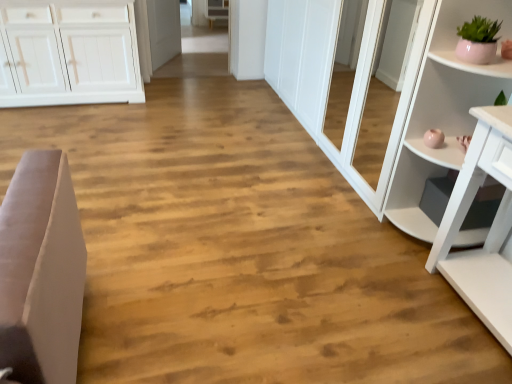
Measure the distance between white glossy shelf at right and camera.

white glossy shelf at right is 1.77 meters from camera.

The height and width of the screenshot is (384, 512). In order to click on white glossy door at center in this screenshot , I will do [163, 30].

Identify the location of white wood cabinet at upper center. This screenshot has height=384, width=512. (216, 10).

The image size is (512, 384). What do you see at coordinates (478, 40) in the screenshot?
I see `matte pink pot at upper right` at bounding box center [478, 40].

At what (x,y) coordinates should I click in order to perform the action: click on white glossy shelf at right. Please return your answer as a coordinate pair (x, y). Image resolution: width=512 pixels, height=384 pixels. Looking at the image, I should click on (441, 112).

Which is closer to the camera, (488,26) or (220,11)?

Point (488,26)

Locate an element on the screen. This screenshot has width=512, height=384. cabinetry directly beneath the matte pink pot at upper right (from a real-world perspective) is located at coordinates (216, 10).

From a real-world perspective, which object rests below the other?

From a 3D spatial view, white wood cabinet at upper center is below.

From the image's perspective, between matte pink pot at upper right and white wood cabinet at upper center, which one is located above?

white wood cabinet at upper center is shown above in the image.

How many degrees apart are the facing directions of white glossy door at center and white glossy shelf at right?

white glossy door at center and white glossy shelf at right are facing 151 degrees away from each other.

From the image's perspective, is white glossy door at center over white glossy shelf at right?

Yes, from the image's perspective, white glossy door at center is over white glossy shelf at right.

Who is bigger, white glossy door at center or white glossy shelf at right?

With larger size is white glossy shelf at right.

I want to click on door behind the white glossy shelf at right, so click(163, 30).

Considering the positions of objects white glossy door at center and matte pink pot at upper right in the image provided, who is more to the left, white glossy door at center or matte pink pot at upper right?

From the viewer's perspective, white glossy door at center appears more on the left side.

Is white glossy door at center positioned before matte pink pot at upper right?

No.

Locate an element on the screen. houseplant in front of the white glossy door at center is located at coordinates (478, 40).

In the scene shown: Considering the relative sizes of white glossy door at center and matte pink pot at upper right in the image provided, is white glossy door at center shorter than matte pink pot at upper right?

Incorrect, the height of white glossy door at center does not fall short of that of matte pink pot at upper right.

Does white glossy shelf at right appear on the right side of matte pink pot at upper right?

Yes, white glossy shelf at right is to the right of matte pink pot at upper right.

Are white glossy shelf at right and matte pink pot at upper right far apart?

No, there isn't a large distance between white glossy shelf at right and matte pink pot at upper right.

Does white glossy shelf at right have a smaller size compared to matte pink pot at upper right?

No, white glossy shelf at right is not smaller than matte pink pot at upper right.

How distant is white glossy shelf at right from matte pink pot at upper right?

white glossy shelf at right and matte pink pot at upper right are 15.01 inches apart from each other.

Locate an element on the screen. cabinetry to the left of white glossy shelf at right is located at coordinates (216, 10).

How different are the orientations of white wood cabinet at upper center and white glossy shelf at right in degrees?

The angle between the facing direction of white wood cabinet at upper center and the facing direction of white glossy shelf at right is 88.3 degrees.

Is white wood cabinet at upper center shorter than white glossy shelf at right?

Indeed, white wood cabinet at upper center has a lesser height compared to white glossy shelf at right.

Between white wood cabinet at upper center and white glossy shelf at right, which one has smaller width?

white wood cabinet at upper center is thinner.

From a real-world perspective, does white wood cabinet at upper center sit lower than white glossy door at center?

Indeed, from a real-world perspective, white wood cabinet at upper center is positioned beneath white glossy door at center.

Is there a large distance between white wood cabinet at upper center and white glossy door at center?

white wood cabinet at upper center is far away from white glossy door at center.

Between white wood cabinet at upper center and white glossy door at center, which one appears on the left side from the viewer's perspective?

Positioned to the left is white glossy door at center.

Which is closer to the camera, (205, 6) or (164, 34)?

Point (205, 6).

From the picture: From the image's perspective, would you say matte pink pot at upper right is shown under white glossy door at center?

Yes.

Is matte pink pot at upper right taller or shorter than white glossy door at center?

Clearly, matte pink pot at upper right is shorter compared to white glossy door at center.

Considering the relative positions of matte pink pot at upper right and white glossy door at center in the image provided, is matte pink pot at upper right to the left or to the right of white glossy door at center?

Based on their positions, matte pink pot at upper right is located to the right of white glossy door at center.

Considering the relative sizes of matte pink pot at upper right and white glossy door at center in the image provided, is matte pink pot at upper right wider than white glossy door at center?

Yes, matte pink pot at upper right is wider than white glossy door at center.

The image size is (512, 384). I want to click on cabinetry above the matte pink pot at upper right (from the image's perspective), so click(x=216, y=10).

Locate an element on the screen. The image size is (512, 384). shelf in front of the white glossy door at center is located at coordinates (441, 112).

From the image, which object appears to be nearer to white glossy shelf at right, white wood cabinet at upper center or matte pink pot at upper right?

matte pink pot at upper right is closer to white glossy shelf at right.

Estimate the real-world distances between objects in this image. Which object is closer to matte pink pot at upper right, white glossy shelf at right or white glossy door at center?

white glossy shelf at right is closer to matte pink pot at upper right.

Considering their positions, is white glossy door at center positioned closer to white wood cabinet at upper center than matte pink pot at upper right?

Among the two, white glossy door at center is located nearer to white wood cabinet at upper center.

Estimate the real-world distances between objects in this image. Which object is further from white glossy door at center, white wood cabinet at upper center or white glossy shelf at right?

white glossy shelf at right is positioned further to the anchor white glossy door at center.

Based on their spatial positions, is white glossy door at center or matte pink pot at upper right closer to white glossy shelf at right?

Among the two, matte pink pot at upper right is located nearer to white glossy shelf at right.

Considering their positions, is matte pink pot at upper right positioned further to white wood cabinet at upper center than white glossy door at center?

Based on the image, matte pink pot at upper right appears to be further to white wood cabinet at upper center.

Estimate the real-world distances between objects in this image. Which object is closer to white wood cabinet at upper center, white glossy door at center or white glossy shelf at right?

white glossy door at center is positioned closer to the anchor white wood cabinet at upper center.

Looking at the image, which one is located closer to white wood cabinet at upper center, matte pink pot at upper right or white glossy shelf at right?

The object closer to white wood cabinet at upper center is white glossy shelf at right.

Find the location of a particular element. door between white glossy shelf at right and white wood cabinet at upper center in the front-back direction is located at coordinates (163, 30).

You are a GUI agent. You are given a task and a screenshot of the screen. Output one action in this format:
    pyautogui.click(x=<x>, y=<y>)
    Task: Click on the houseplant between white glossy shelf at right and white wood cabinet at upper center in the front-back direction
    The height and width of the screenshot is (384, 512).
    Given the screenshot: What is the action you would take?
    pyautogui.click(x=478, y=40)

In order to click on houseplant between white glossy shelf at right and white glossy door at center in the front-back direction in this screenshot , I will do `click(478, 40)`.

Where is `door located between matte pink pot at upper right and white wood cabinet at upper center in the depth direction`? This screenshot has width=512, height=384. door located between matte pink pot at upper right and white wood cabinet at upper center in the depth direction is located at coordinates (163, 30).